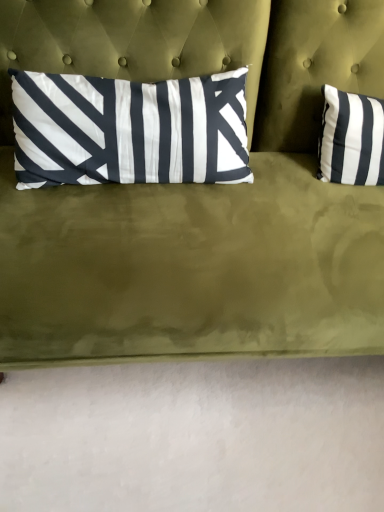
Locate an element on the screen. white silk pillow at center is located at coordinates (196, 197).

What do you see at coordinates (196, 197) in the screenshot? The height and width of the screenshot is (512, 384). I see `white silk pillow at center` at bounding box center [196, 197].

This screenshot has height=512, width=384. What are the coordinates of `white silk pillow at center` in the screenshot? It's located at (196, 197).